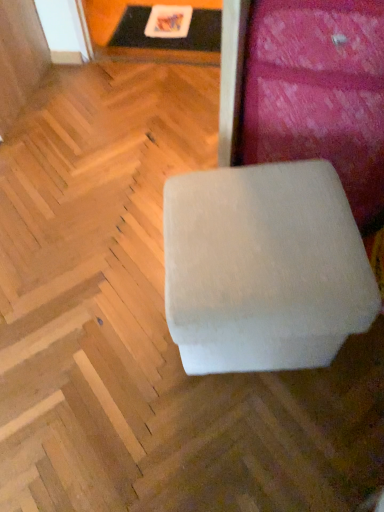
Question: Is point (284, 57) positioned closer to the camera than point (324, 293)?

Choices:
 (A) closer
 (B) farther

Answer: (B)

Question: In terms of size, does white fabric ottoman at center, arranged as the first furniture when viewed from the top, appear bigger or smaller than white fabric ottoman at center, which appears as the 2th furniture when viewed from the top?

Choices:
 (A) small
 (B) big

Answer: (B)

Question: Which is nearer to the white plastic tray at upper center?

Choices:
 (A) white fabric ottoman at center, acting as the second furniture starting from the bottom
 (B) white fabric ottoman at center, which appears as the 1th furniture when ordered from the bottom

Answer: (A)

Question: Which object is the farthest from the white fabric ottoman at center, acting as the second furniture starting from the bottom?

Choices:
 (A) white plastic tray at upper center
 (B) white fabric ottoman at center, which appears as the 2th furniture when viewed from the top

Answer: (A)